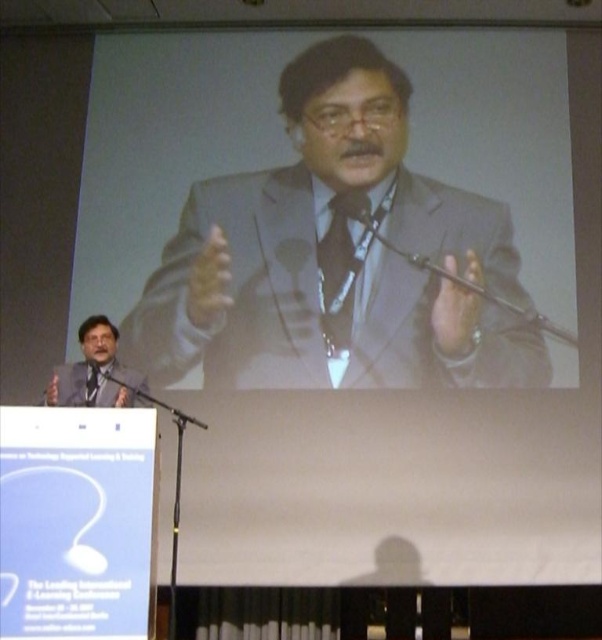
Consider the image. You are a photographer positioned at the camera location. You need to capture a clear photo of the matte gray suit at center. Considering the distance between you and the subject, what should you adjust on your camera to ensure the subject is in focus?

Since the matte gray suit at center is 4.73 meters away from the camera, you should adjust the focus distance to 4.73 meters to ensure the subject is in focus.

You are standing in the conference room and want to determine which of the two points, point (98, 392) or point (87, 385), is closer to you. Based on the scene description, which point is nearer?

Point (98, 392) is closer to the viewer than point (87, 385).

Looking at this image, you are organizing a photo shoot and need to ensure that the matte black suit at lower left and the black silk tie at center are positioned in a way that they are at least 10 centimeters apart. Based on the scene, are they currently meeting this requirement?

The distance between the matte black suit at lower left and the black silk tie at center is 9.81 centimeters, which is less than the required 10 centimeters. Therefore, they are not meeting the requirement and need to be adjusted to increase the distance between them.